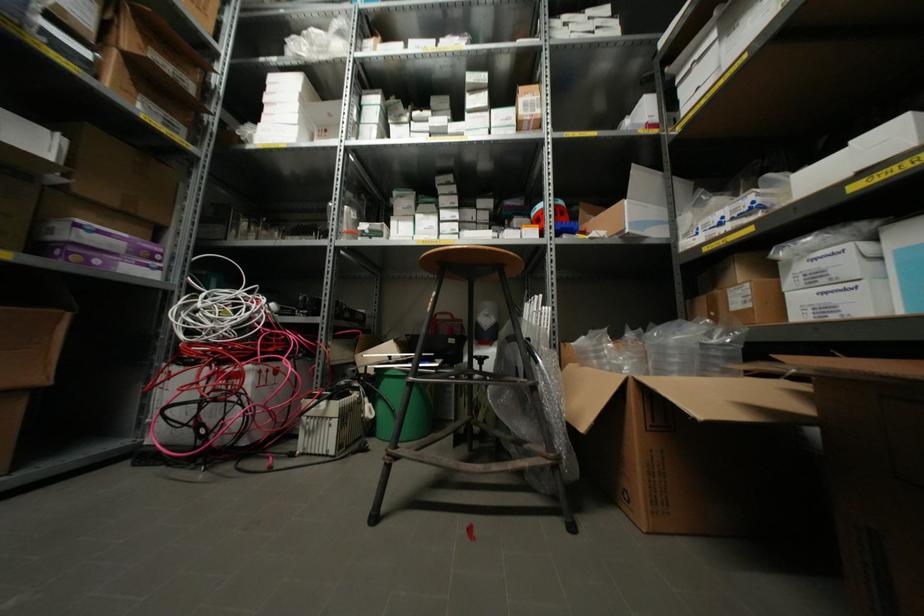
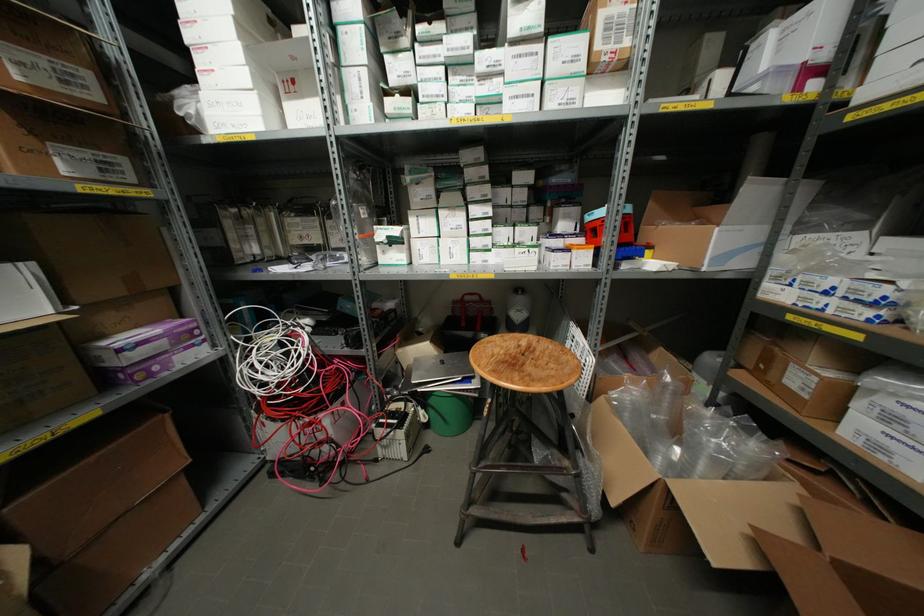
The point at (265, 99) is marked in the first image. Where is the corresponding point in the second image?

(188, 36)